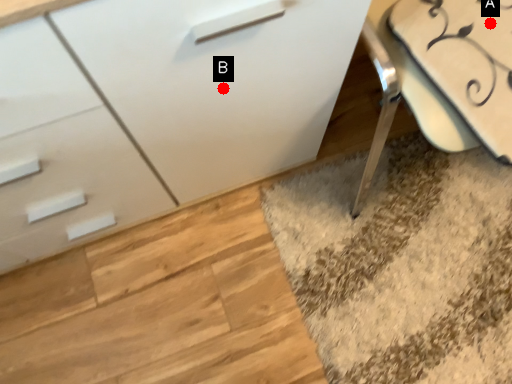
Question: Two points are circled on the image, labeled by A and B beside each circle. Which point is farther from the camera taking this photo?

Choices:
 (A) A is further
 (B) B is further

Answer: (A)